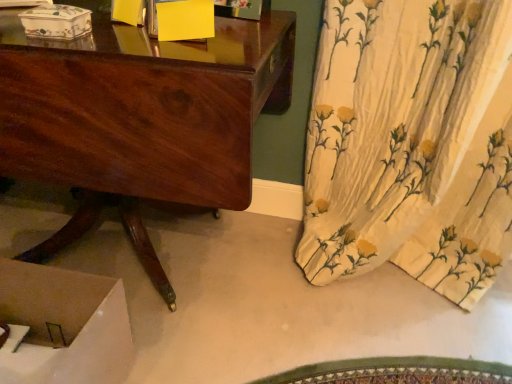
The height and width of the screenshot is (384, 512). What are the coordinates of `free space between porcelain floral box at upper left, the first box positioned from the left, and yellow paper at upper center, which is counted as the first box, starting from the right` in the screenshot? It's located at (123, 40).